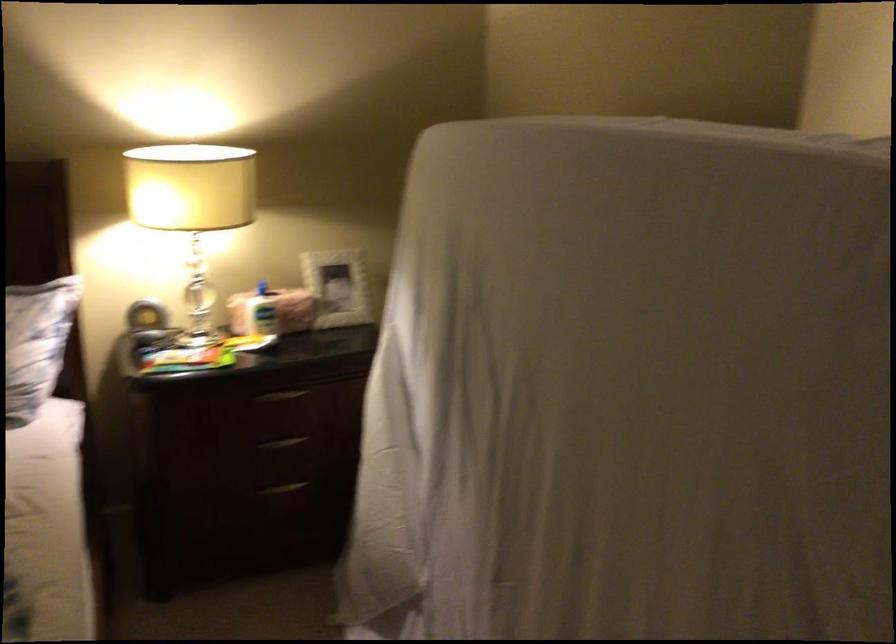
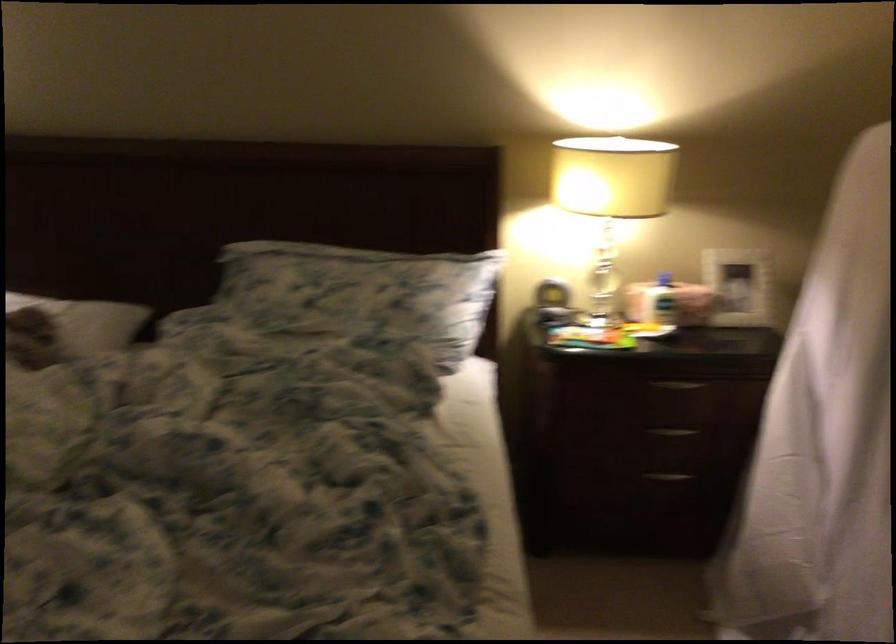
What movement of the cameraman would produce the second image?

The cameraman moved toward left, backward.